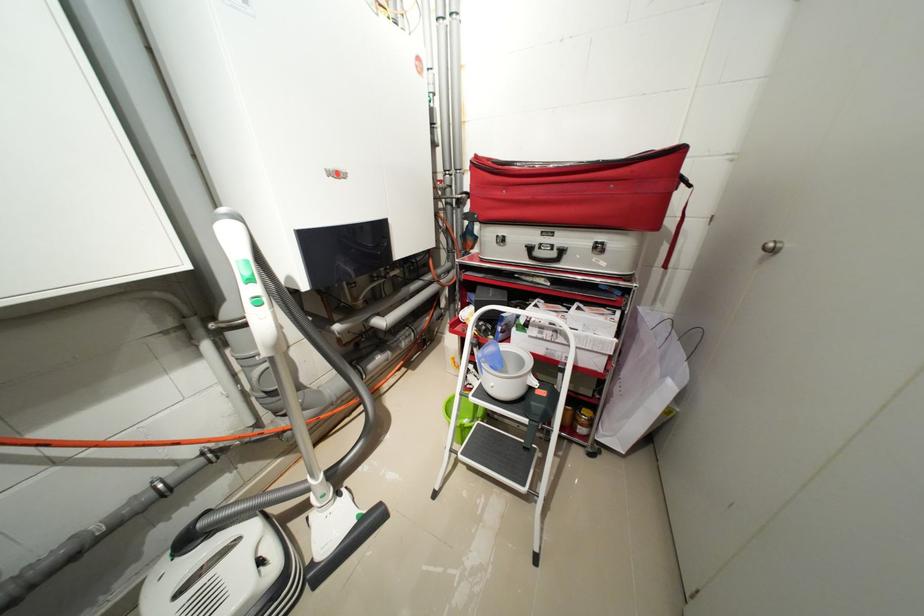
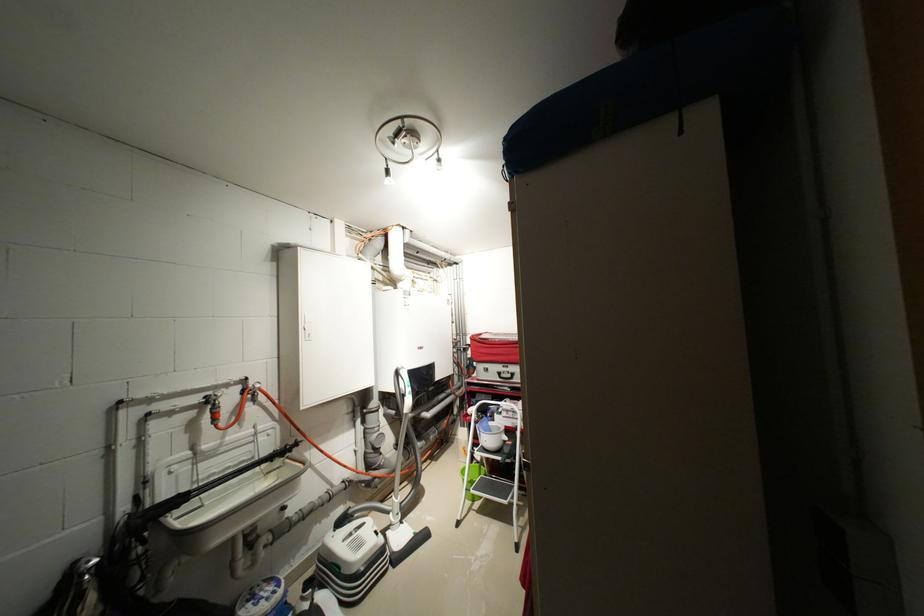
The point at (455, 184) is marked in the first image. Where is the corresponding point in the second image?

(466, 341)